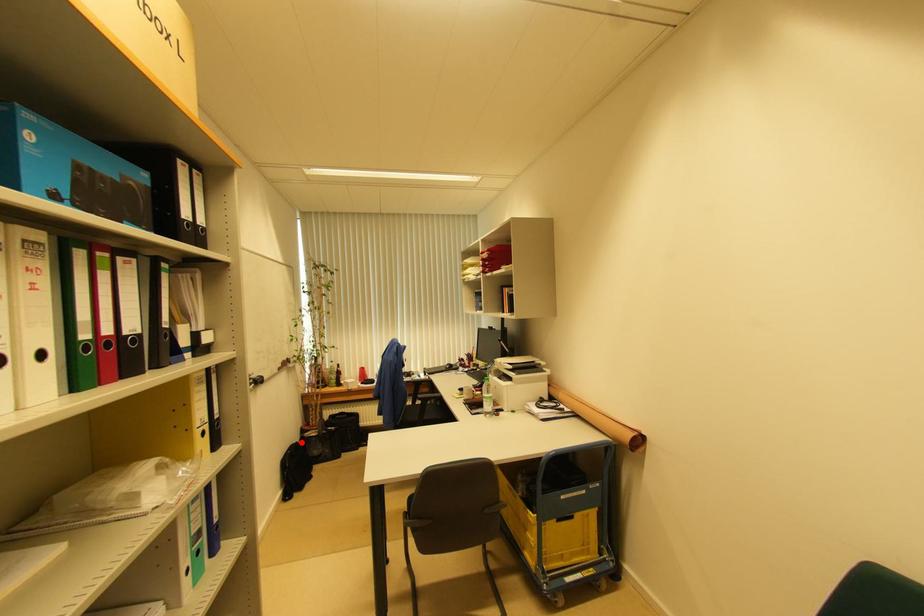
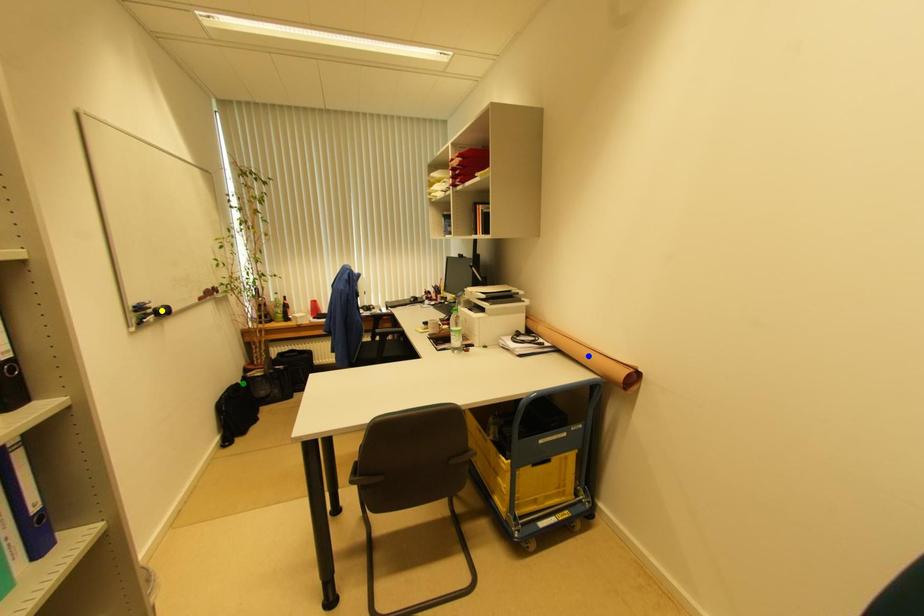
Question: I am providing you with two images of the same scene from different viewpoints. A red point is marked on the first image. You are given multiple points on the second image. Which point in image 2 is actually the same real-world point as the red point in image 1?

Choices:
 (A) blue point
 (B) green point
 (C) yellow point

Answer: (B)